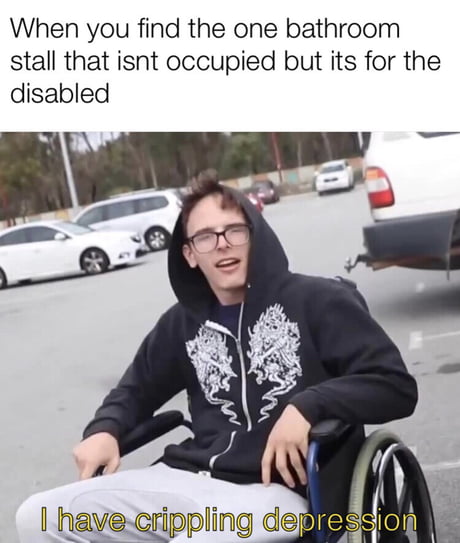
Image resolution: width=460 pixels, height=543 pixels. Find the location of `arm rest`. arm rest is located at coordinates (340, 431).